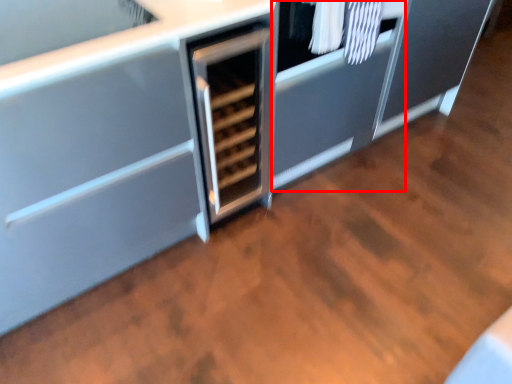
Question: From the image's perspective, where is cabinetry (annotated by the red box) located in relation to laundry in the image?

Choices:
 (A) above
 (B) below

Answer: (B)